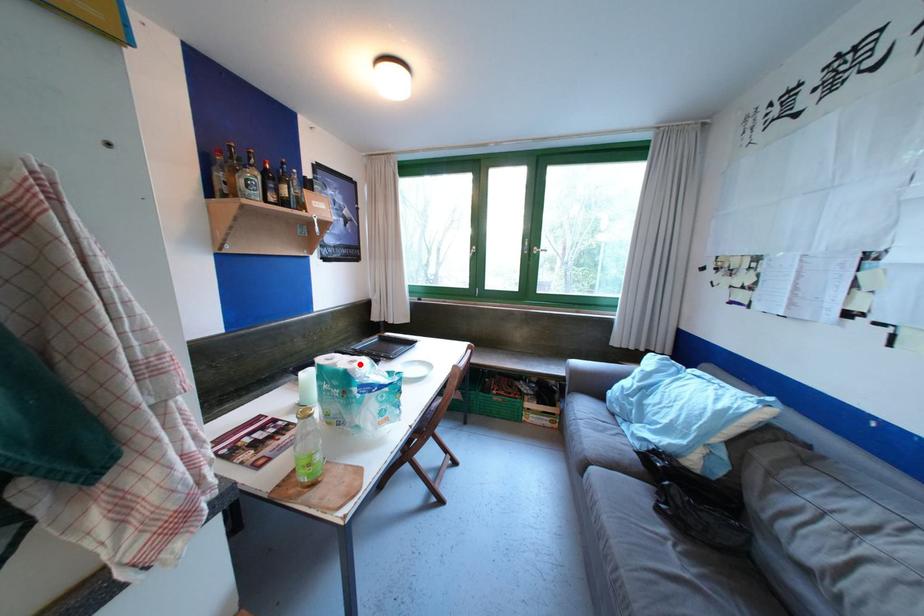
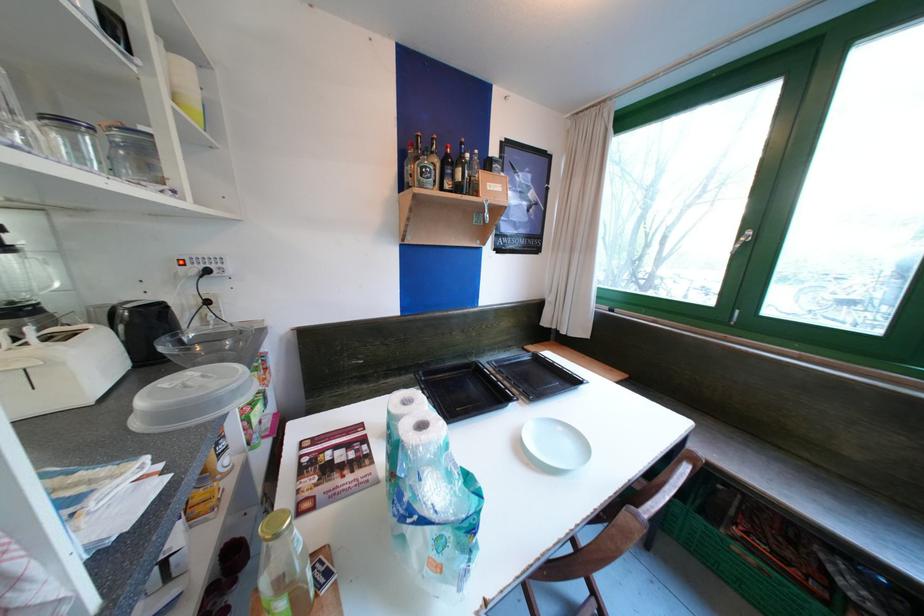
In the second image, find the point that corresponds to the highlighted location in the first image.

(430, 428)